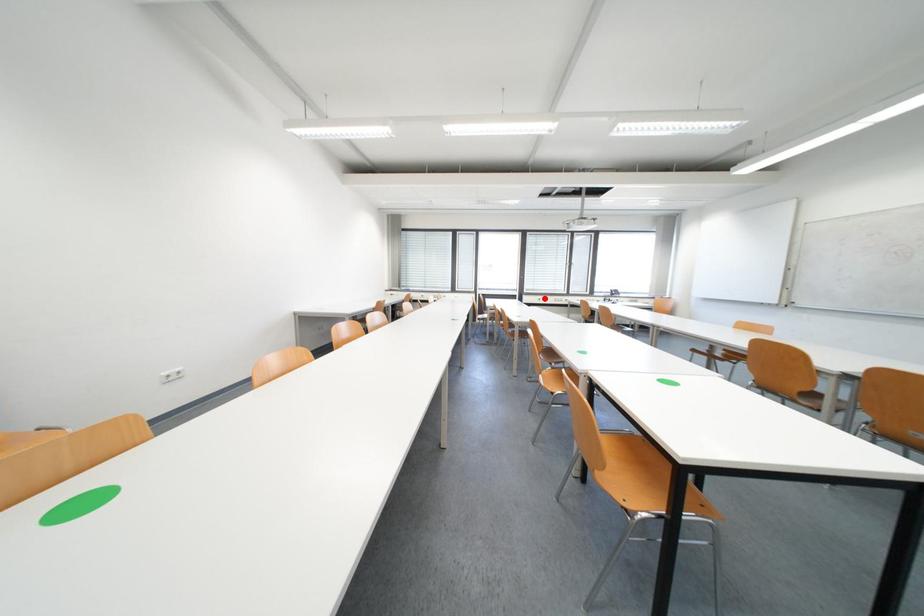
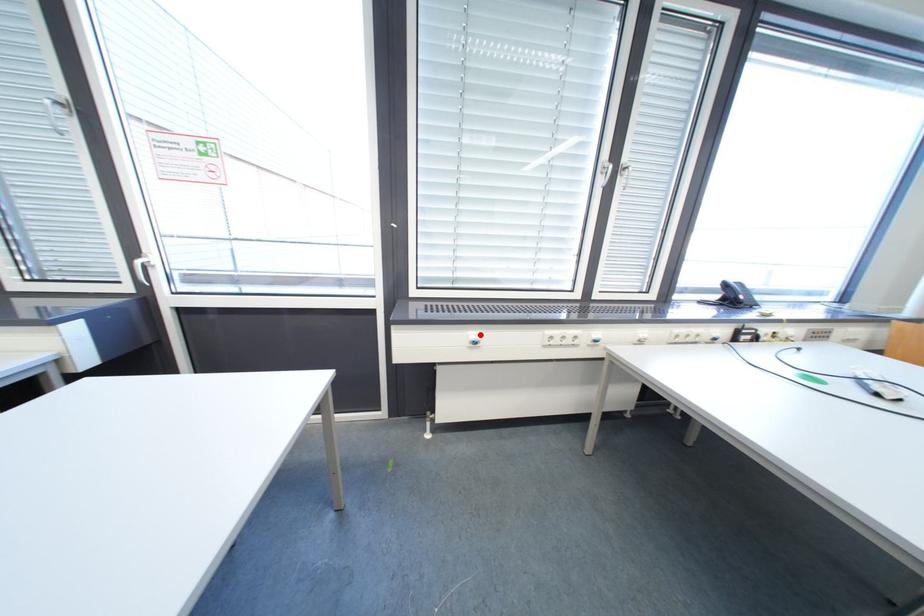
Consider the image. I am providing you with two images of the same scene from different viewpoints. A red point is marked on the first image and another point is marked on the second image. Is the marked point in image1 the same physical position as the marked point in image2?

Yes